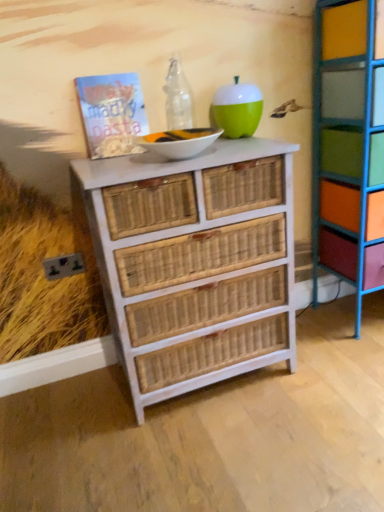
Question: Is multicolored painted wood shelf at right oriented away from matte paper book at upper left?

Choices:
 (A) no
 (B) yes

Answer: (A)

Question: From a real-world perspective, is multicolored painted wood shelf at right positioned under matte paper book at upper left based on gravity?

Choices:
 (A) no
 (B) yes

Answer: (B)

Question: From the image's perspective, is multicolored painted wood shelf at right on matte paper book at upper left?

Choices:
 (A) yes
 (B) no

Answer: (B)

Question: Would you say matte paper book at upper left is part of multicolored painted wood shelf at right's contents?

Choices:
 (A) no
 (B) yes

Answer: (A)

Question: Is multicolored painted wood shelf at right to the left of matte paper book at upper left from the viewer's perspective?

Choices:
 (A) no
 (B) yes

Answer: (A)

Question: Is multicolored painted wood shelf at right smaller than matte paper book at upper left?

Choices:
 (A) yes
 (B) no

Answer: (B)

Question: Is green matte apple at upper center oriented away from white wicker chest of drawers at center?

Choices:
 (A) no
 (B) yes

Answer: (A)

Question: Is white wicker chest of drawers at center a part of green matte apple at upper center?

Choices:
 (A) yes
 (B) no

Answer: (B)

Question: Is green matte apple at upper center wider than white wicker chest of drawers at center?

Choices:
 (A) no
 (B) yes

Answer: (A)

Question: Can you confirm if green matte apple at upper center is smaller than white wicker chest of drawers at center?

Choices:
 (A) yes
 (B) no

Answer: (A)

Question: Can you confirm if green matte apple at upper center is positioned to the left of white wicker chest of drawers at center?

Choices:
 (A) yes
 (B) no

Answer: (B)

Question: Would you say green matte apple at upper center is a long distance from white wicker chest of drawers at center?

Choices:
 (A) yes
 (B) no

Answer: (B)

Question: Is matte paper book at upper left facing towards green matte apple at upper center?

Choices:
 (A) yes
 (B) no

Answer: (B)